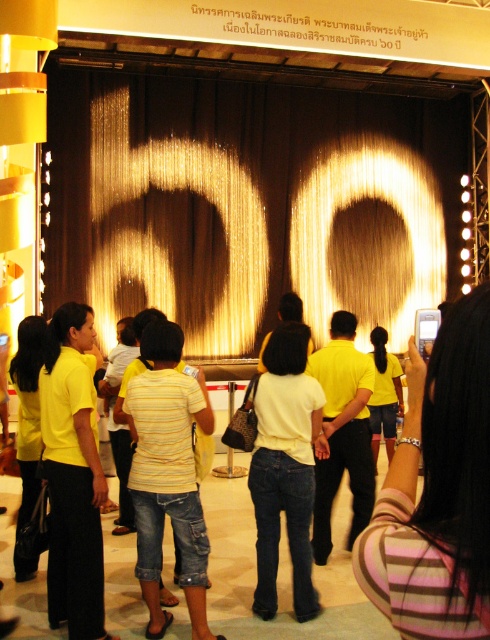
You are a photographer at the event and want to capture the striped fabric dress at center and the yellow fabric shorts at center. Which one should you focus on to ensure the other is still visible in the background?

The striped fabric dress at center is in front of the yellow fabric shorts at center, so focusing on the striped fabric dress at center will keep the yellow fabric shorts at center visible in the background.

You are standing at the center of the stage and want to move towards the point that is closer to the front of the stage. Which point should you move towards, point (147, 388) or point (34, 417)?

Point (34, 417) is closer to the front of the stage, so you should move towards point (34, 417).

You are a photographer at the event and need to capture both the striped fabric dress at center and the yellow fabric shorts at center in a single frame. Which clothing item will appear wider in the photo?

The yellow fabric shorts at center will appear wider in the photo since its width is greater than the striped fabric dress at center.